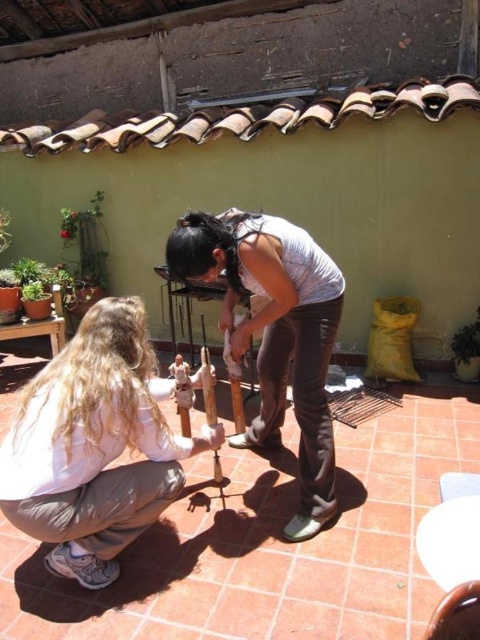
Question: Which point is closer to the camera taking this photo?

Choices:
 (A) [x=57, y=362]
 (B) [x=262, y=412]

Answer: (A)

Question: Is light brown hair at lower left bigger than matte white shirt at center?

Choices:
 (A) no
 (B) yes

Answer: (A)

Question: Which point appears closest to the camera in this image?

Choices:
 (A) (236, 436)
 (B) (85, 516)

Answer: (B)

Question: Does light brown hair at lower left appear under matte white shirt at center?

Choices:
 (A) no
 (B) yes

Answer: (B)

Question: Which point is farther from the camera taking this photo?

Choices:
 (A) (68, 390)
 (B) (268, 368)

Answer: (B)

Question: From the image, what is the correct spatial relationship of light brown hair at lower left in relation to matte white shirt at center?

Choices:
 (A) left
 (B) right

Answer: (A)